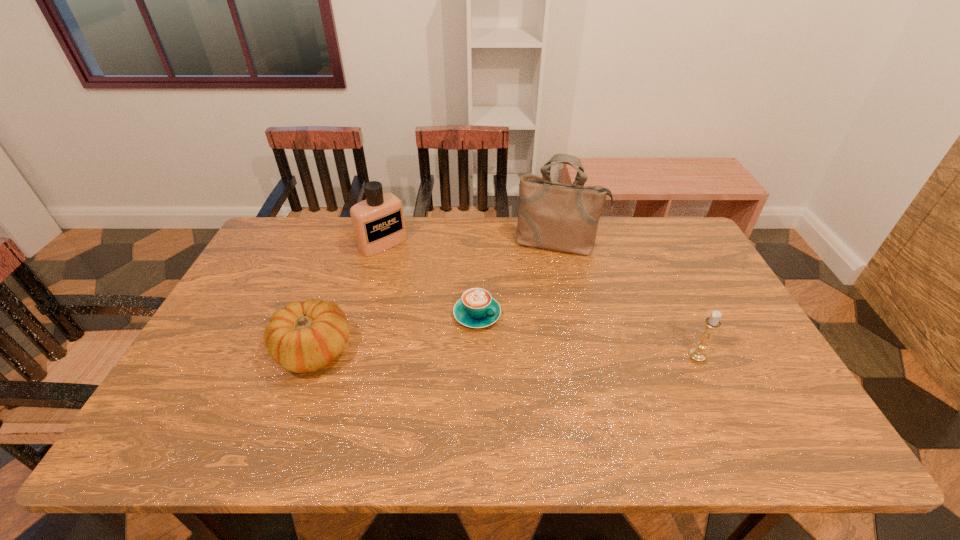
At what (x,y) coordinates should I click in order to perform the action: click on blank area in the image that satisfies the following two spatial constraints: 1. on the back side of the fourth tallest object; 2. on the right side of the third object from left to right. Please return your answer as a coordinate pair (x, y). The image size is (960, 540). Looking at the image, I should click on (326, 314).

Locate an element on the screen. blank space that satisfies the following two spatial constraints: 1. on the back side of the shortest object; 2. on the right side of the tallest object is located at coordinates (477, 244).

Locate an element on the screen. Image resolution: width=960 pixels, height=540 pixels. vacant position in the image that satisfies the following two spatial constraints: 1. on the back side of the gourd; 2. on the left side of the third object from right to left is located at coordinates (326, 314).